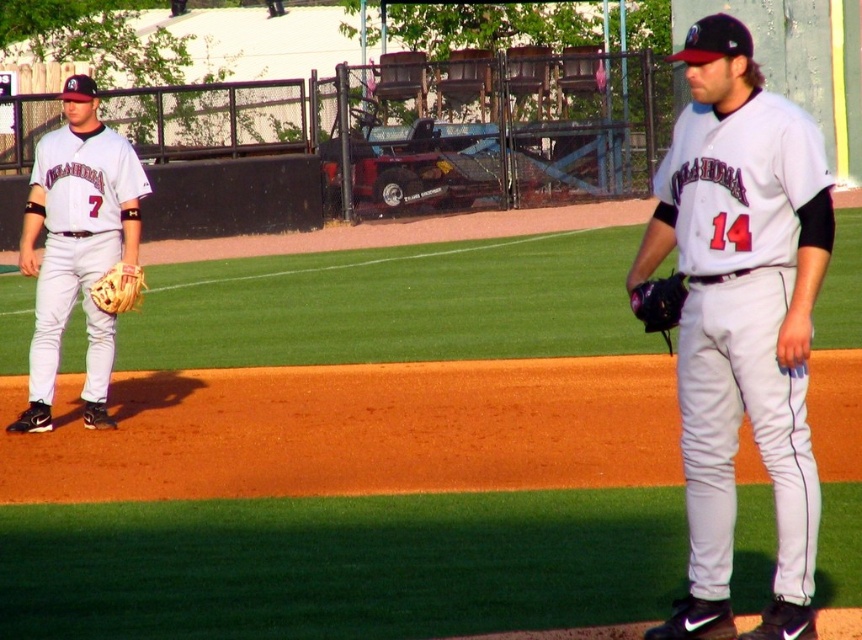
Question: Which point appears farthest from the camera in this image?

Choices:
 (A) (138, 189)
 (B) (135, 272)

Answer: (A)

Question: Is matte white uniform at left to the left of brown leather glove at left from the viewer's perspective?

Choices:
 (A) yes
 (B) no

Answer: (A)

Question: Which object is positioned farthest from the brown leather glove at left?

Choices:
 (A) white matte baseball uniform at center
 (B) dark brown leather glove at right

Answer: (A)

Question: Is dark brown leather glove at right to the left of brown leather glove at left from the viewer's perspective?

Choices:
 (A) yes
 (B) no

Answer: (B)

Question: Which object is closer to the camera taking this photo?

Choices:
 (A) matte white uniform at left
 (B) brown leather glove at left

Answer: (B)

Question: Does white matte baseball uniform at center have a greater width compared to matte white uniform at left?

Choices:
 (A) no
 (B) yes

Answer: (A)